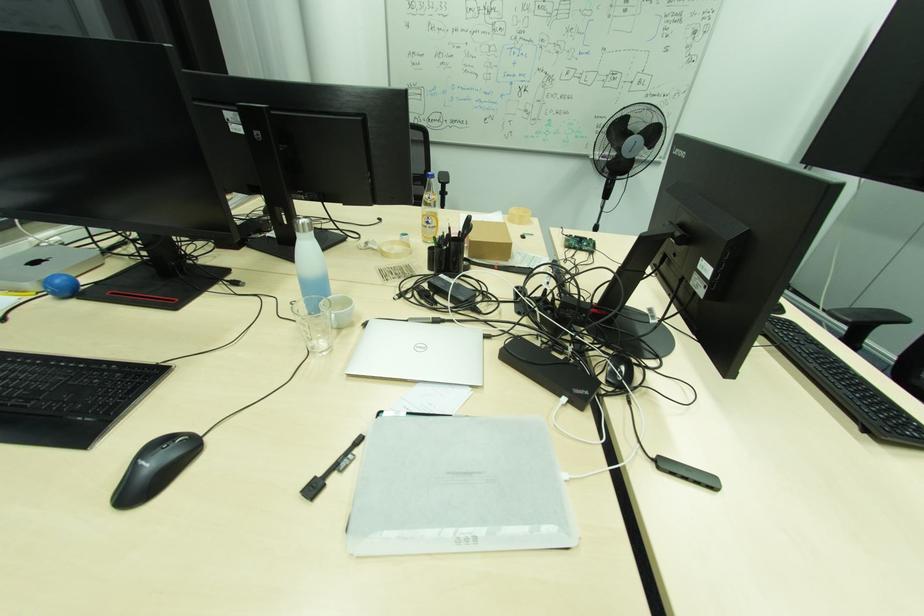
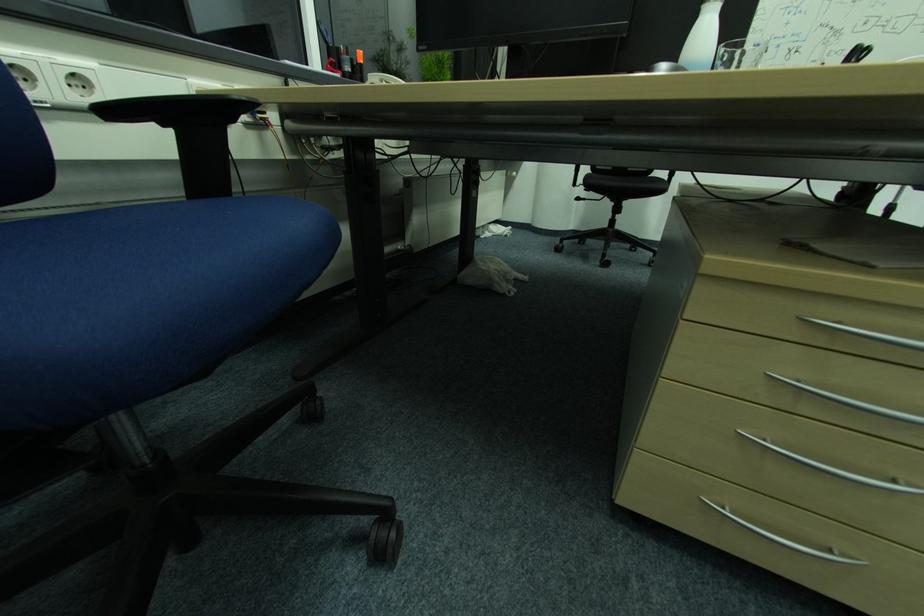
Question: Based on the continuous images, in which direction is the camera rotating? Reply with the corresponding letter.

Choices:
 (A) Left
 (B) Right
 (C) Up
 (D) Down

Answer: (A)